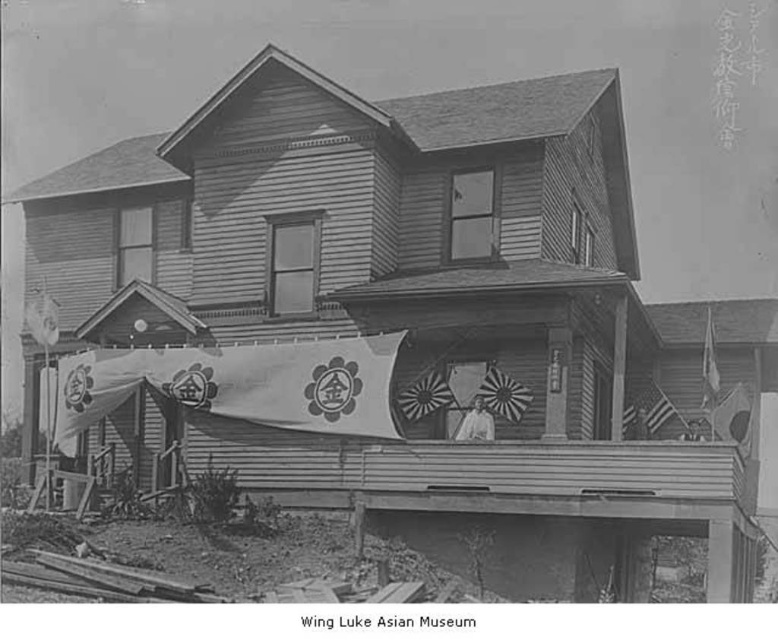
Can you confirm if white fabric banner at left is positioned above american flag at upper right?

Yes, white fabric banner at left is above american flag at upper right.

Consider the image. Who is positioned more to the left, white fabric banner at left or american flag at upper right?

From the viewer's perspective, white fabric banner at left appears more on the left side.

This screenshot has height=640, width=778. I want to click on white fabric banner at left, so click(41, 317).

At what (x,y) coordinates should I click in order to perform the action: click on white fabric banner at left. Please return your answer as a coordinate pair (x, y). The image size is (778, 640). Looking at the image, I should click on (41, 317).

The height and width of the screenshot is (640, 778). Describe the element at coordinates (240, 385) in the screenshot. I see `silky white banner at center` at that location.

Who is more forward, (131, 358) or (47, 296)?

Point (131, 358)

Does point (323, 401) come closer to viewer compared to point (51, 323)?

That is True.

Locate an element on the screen. silky white banner at center is located at coordinates (240, 385).

Between point (30, 312) and point (663, 401), which one is positioned in front?

Positioned in front is point (30, 312).

Can you confirm if white fabric banner at left is wider than silky fabric flag at right?

Correct, the width of white fabric banner at left exceeds that of silky fabric flag at right.

Is point (32, 323) closer to camera compared to point (664, 412)?

That is True.

Locate an element on the screen. The height and width of the screenshot is (640, 778). white fabric banner at left is located at coordinates (41, 317).